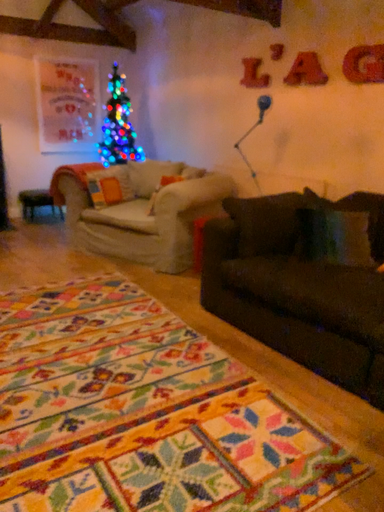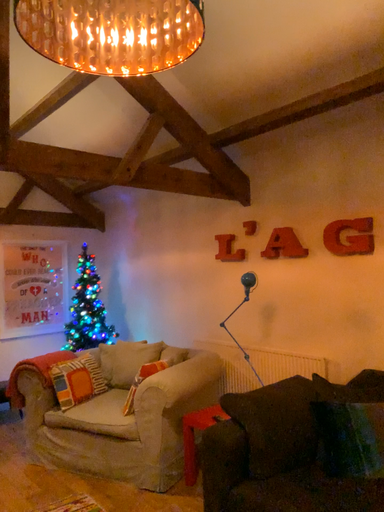
Question: How did the camera likely rotate when shooting the video?

Choices:
 (A) rotated downward
 (B) rotated upward

Answer: (B)